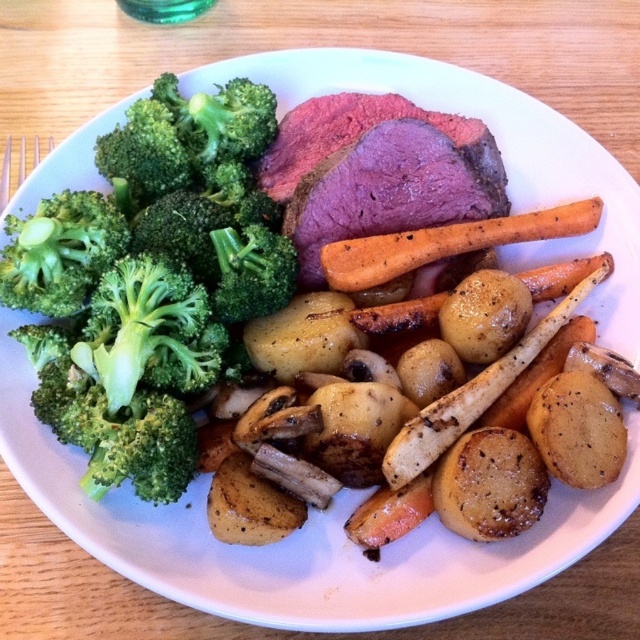
Who is more forward, (595, 445) or (3, 170)?

Point (595, 445)

Measure the distance between point (568, 396) and camera.

Point (568, 396) and camera are 1.09 meters apart.

This screenshot has width=640, height=640. What do you see at coordinates (577, 429) in the screenshot? I see `brown crispy potato at center-right` at bounding box center [577, 429].

The height and width of the screenshot is (640, 640). What are the coordinates of `brown crispy potato at center-right` in the screenshot? It's located at (577, 429).

Which is below, pinkish-brown meat at upper center or orange glazed carrot at center?

orange glazed carrot at center is lower down.

Where is `pinkish-brown meat at upper center`? This screenshot has width=640, height=640. pinkish-brown meat at upper center is located at coordinates (376, 172).

Between point (433, 170) and point (340, 241), which one is positioned in front?

Point (340, 241) is more forward.

The width and height of the screenshot is (640, 640). In order to click on pinkish-brown meat at upper center in this screenshot , I will do `click(376, 172)`.

Who is more distant from viewer, (131, 244) or (372, 317)?

Point (372, 317)

Is green fresh broccoli at left positioned in front of golden-brown roasted carrot at center-right?

Yes, green fresh broccoli at left is in front of golden-brown roasted carrot at center-right.

Does point (221, 356) lie in front of point (358, 324)?

Yes, point (221, 356) is closer to viewer.

In order to click on green fresh broccoli at left in this screenshot , I will do `click(148, 282)`.